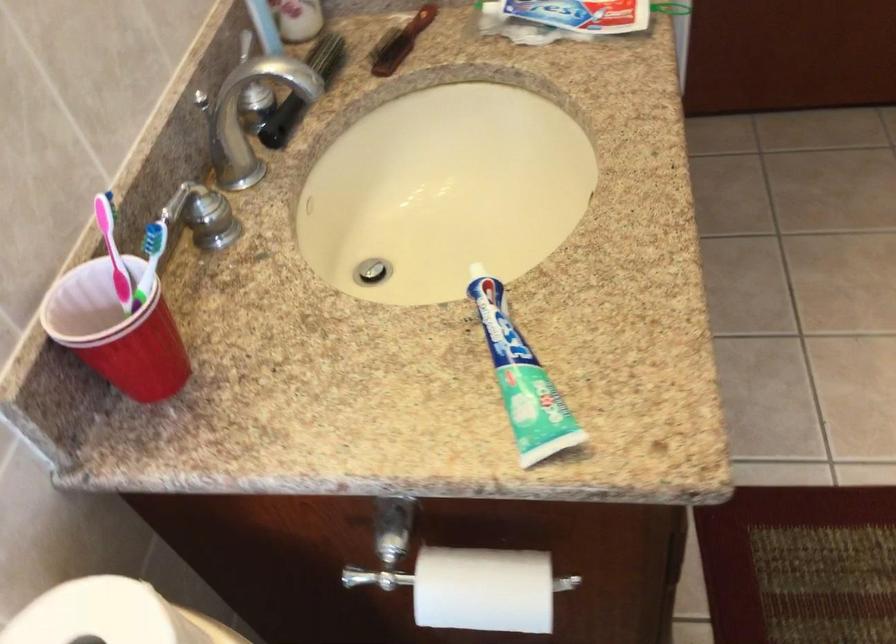
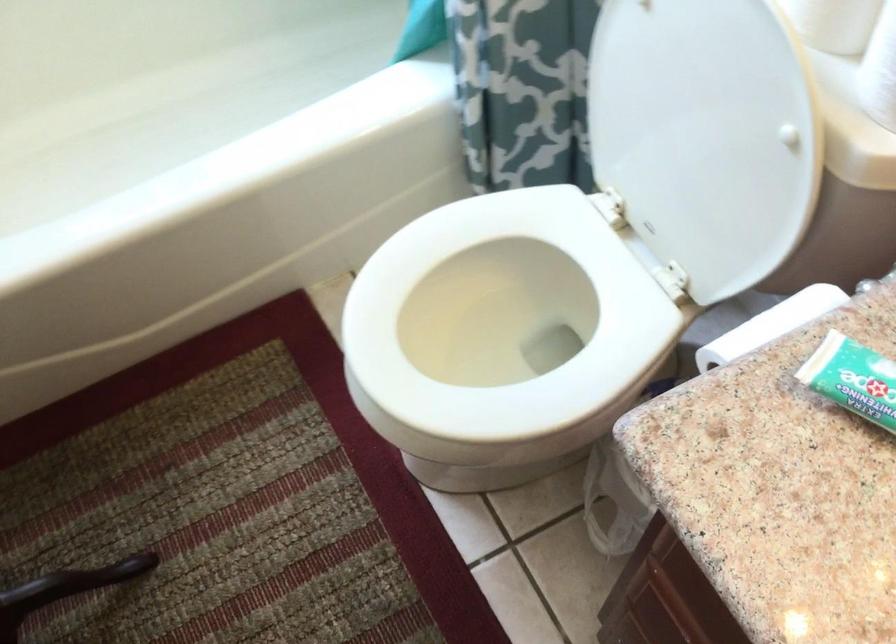
Find the pixel in the second image that matches point (549, 426) in the first image.

(853, 379)